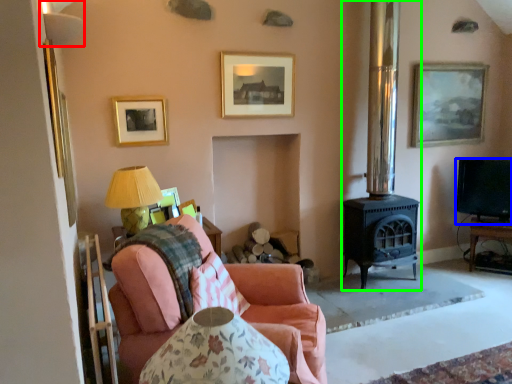
Question: Based on their relative distances, which object is nearer to lamp (highlighted by a red box)? Choose from television (highlighted by a blue box) and fireplace (highlighted by a green box).

Choices:
 (A) television
 (B) fireplace

Answer: (B)